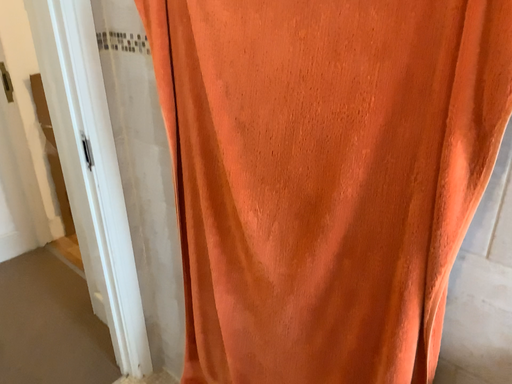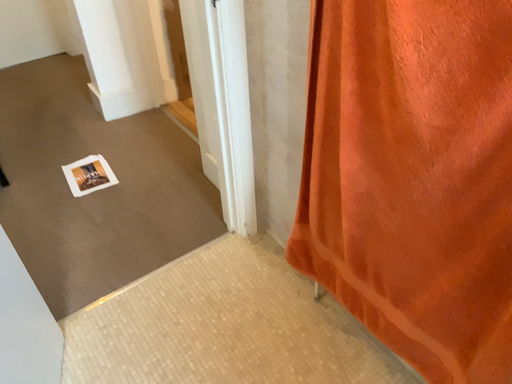
Question: How did the camera likely rotate when shooting the video?

Choices:
 (A) rotated upward
 (B) rotated downward

Answer: (B)